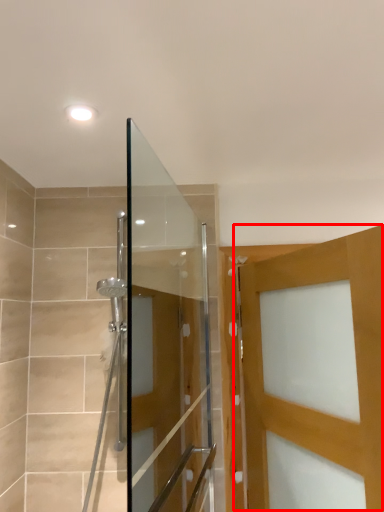
Question: Where is door (annotated by the red box) located in relation to screen door in the image?

Choices:
 (A) right
 (B) left

Answer: (A)